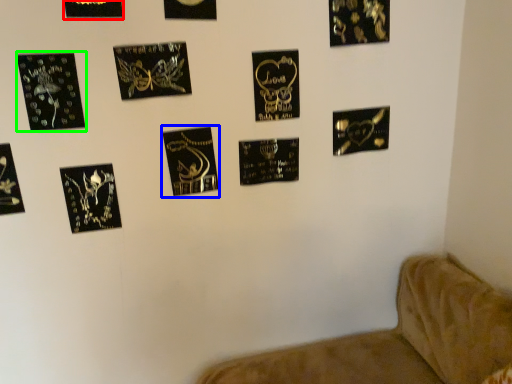
Question: Which object is the closest to the picture frame (highlighted by a red box)? Choose among these: picture frame (highlighted by a blue box) or picture frame (highlighted by a green box).

Choices:
 (A) picture frame
 (B) picture frame

Answer: (B)